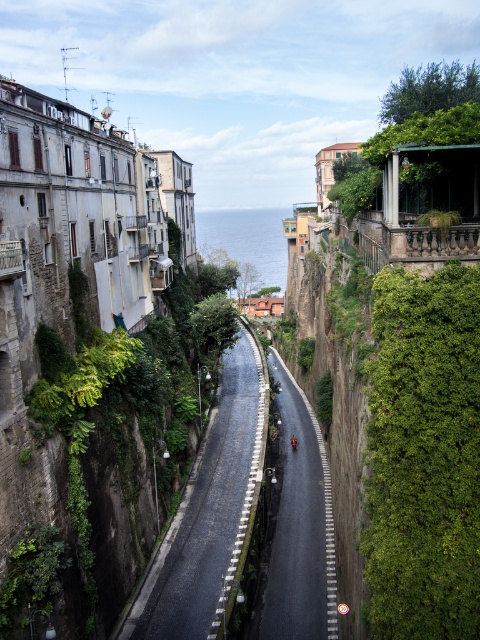
You are a tourist standing on the road in this Mediterranean coastal town. You notice two green areas ahead of you. One is the green leafy vegetation at center and the other is the green leafy wall at right. Which of these two green areas is positioned more to your left side?

The green leafy vegetation at center is positioned to the left of the green leafy wall at right, so it is more to the left side.

You are a delivery driver navigating through this narrow street. You need to park your vehicle on the side of the road but want to ensure there is enough space. Given the green leafy wall at right and the black asphalt road at center, which area takes up more space in the scene?

The black asphalt road at center occupies more space than the green leafy wall at right, so parking on the road side would have more available space.

You are a tourist standing on the narrow road in the Mediterranean town. You see the green leafy wall at right and the metallic red motorcycle at center. Which object is located to the right of the other?

The green leafy wall at right is positioned on the right side of the metallic red motorcycle at center, so the green leafy wall at right is to the right of the metallic red motorcycle at center.